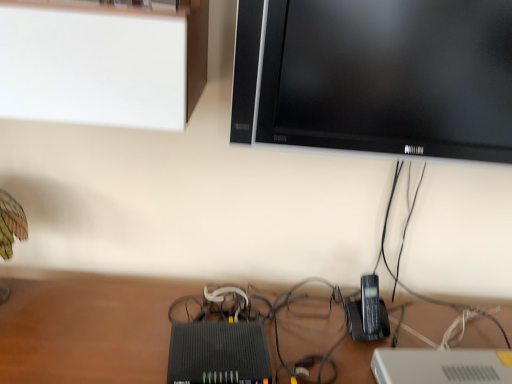
Question: From a real-world perspective, is black plastic phone at lower right physically located above or below black glossy tv at upper right?

Choices:
 (A) above
 (B) below

Answer: (B)

Question: Based on their positions, is black plastic phone at lower right located to the left or right of black glossy tv at upper right?

Choices:
 (A) left
 (B) right

Answer: (A)

Question: Considering their positions, is black plastic phone at lower right located in front of or behind black glossy tv at upper right?

Choices:
 (A) behind
 (B) front

Answer: (A)

Question: In terms of size, does black glossy tv at upper right appear bigger or smaller than black plastic phone at lower right?

Choices:
 (A) small
 (B) big

Answer: (B)

Question: From a real-world perspective, is black glossy tv at upper right above or below black plastic phone at lower right?

Choices:
 (A) below
 (B) above

Answer: (B)

Question: In the image, is black glossy tv at upper right on the left side or the right side of black plastic phone at lower right?

Choices:
 (A) left
 (B) right

Answer: (B)

Question: Is point (493, 28) closer or farther from the camera than point (371, 336)?

Choices:
 (A) farther
 (B) closer

Answer: (B)